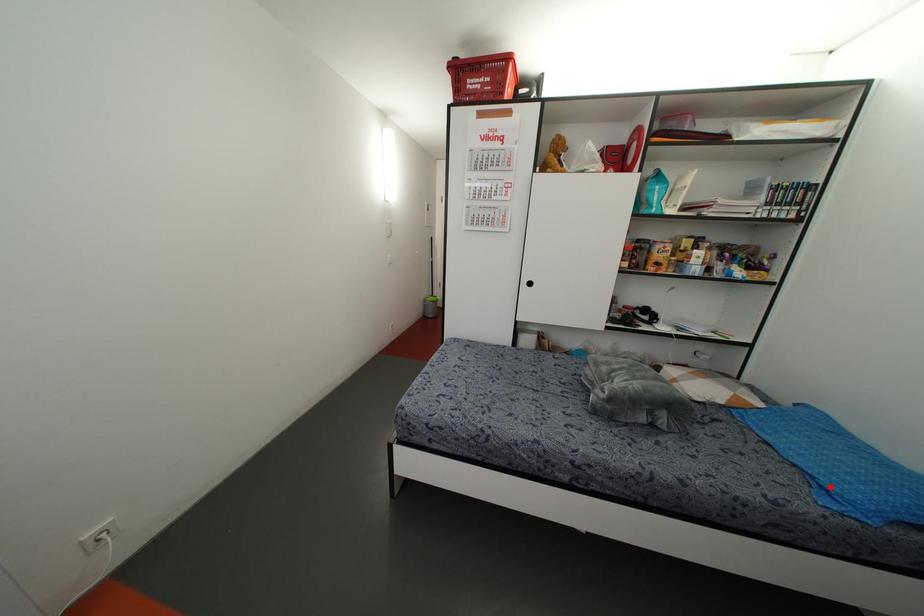
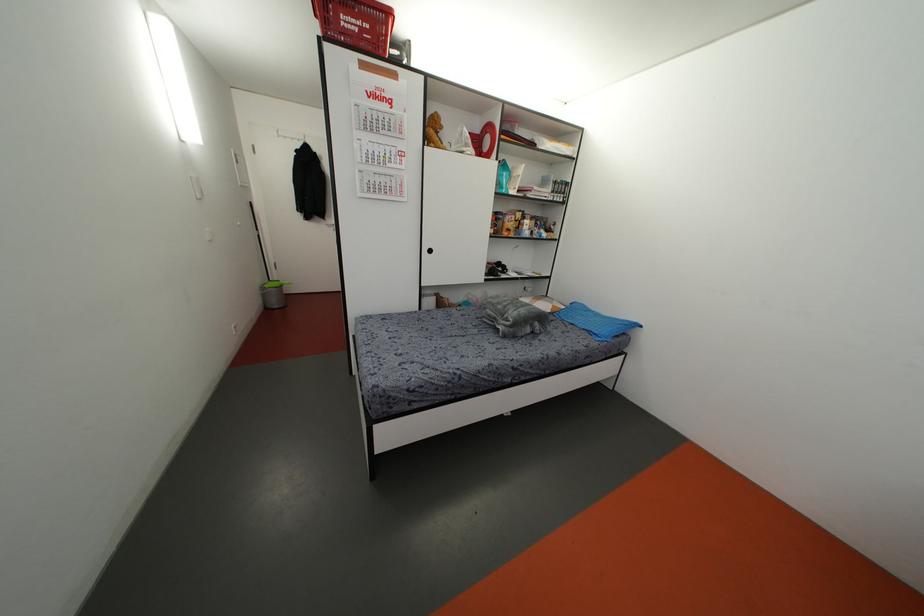
In the second image, find the point that corresponds to the highlighted location in the first image.

(596, 331)